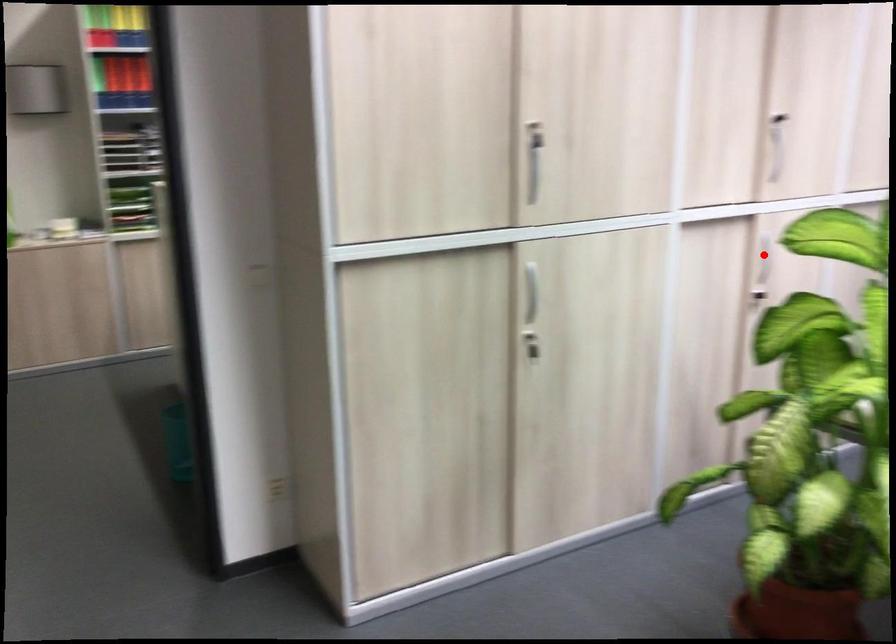
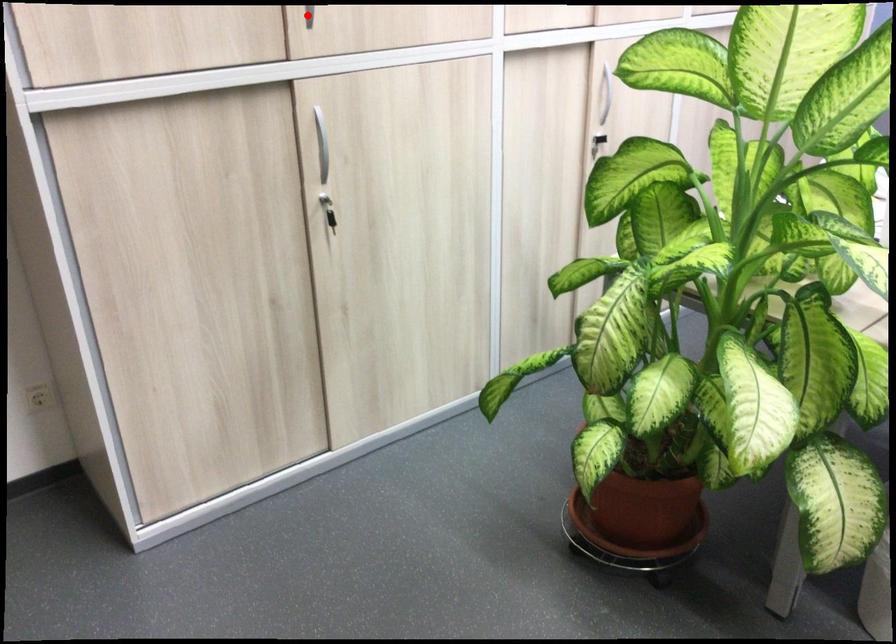
In the scene shown: I am providing you with two images of the same scene from different viewpoints. A red point is marked on the first image and another point is marked on the second image. Is the marked point in image1 the same physical position as the marked point in image2?

No